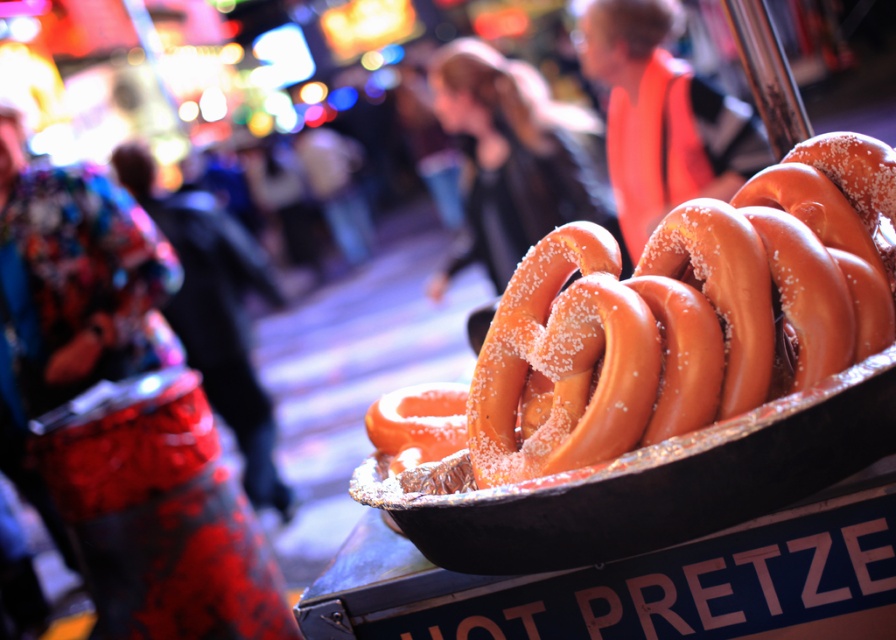
You are a customer at the pretzel stand. You want to choose the pretzel that is thinner between the sugared golden pretzel at right and the sugared pretzel at right. Which one should you pick?

The sugared golden pretzel at right is thinner than the sugared pretzel at right, so you should pick the sugared golden pretzel at right.

You are a customer at the pretzel stand. You want to choose the larger pretzel between the sugared golden pretzel at right and the sugared pretzel at right. Which one should you pick?

The sugared pretzel at right is larger than the sugared golden pretzel at right, so you should pick the sugared pretzel at right.

You are a customer at the pretzel stand. You want to choose the taller pretzel between the sugared golden pretzel at right and the sugared pretzel at right. Which one should you pick?

The sugared pretzel at right is taller than the sugared golden pretzel at right, so you should pick the sugared pretzel at right.